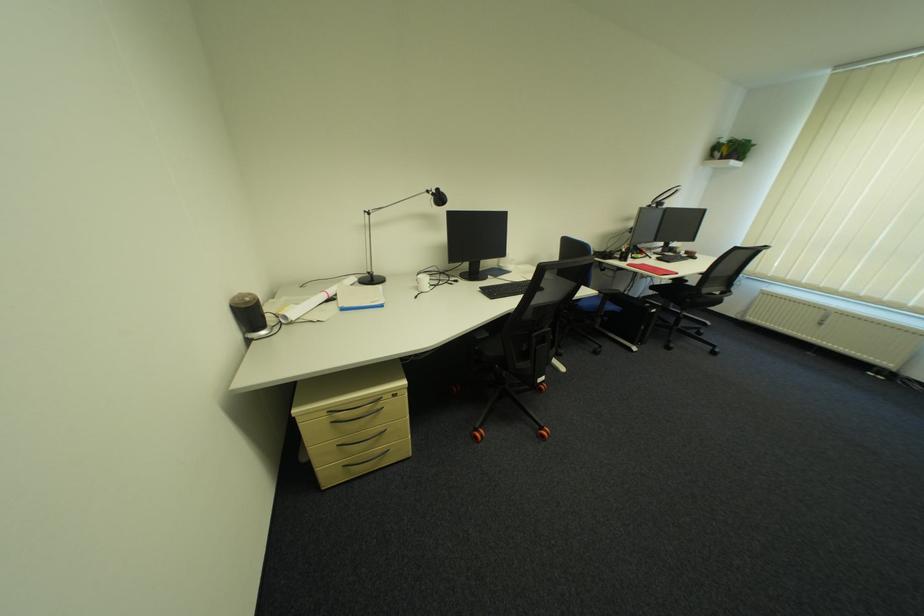
Which object does [422,282] point to?

It corresponds to the white ceramic mug in the image.